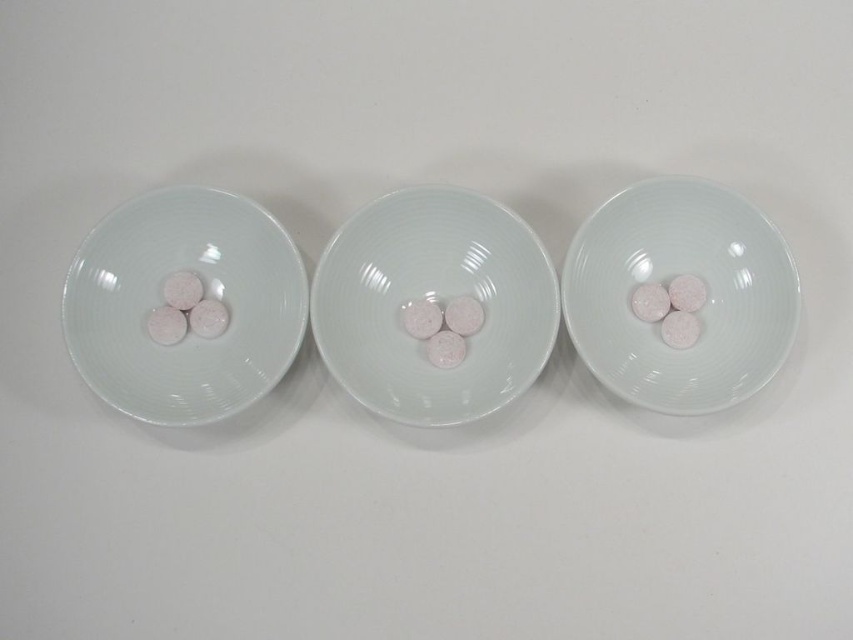
Is porcelain bowls at center smaller than white glossy plate at left?

Yes.

Who is taller, porcelain bowls at center or white glossy plate at left?

porcelain bowls at center

Between point (538, 244) and point (196, 244), which one is positioned in front?

Point (538, 244) is more forward.

This screenshot has height=640, width=853. What are the coordinates of `porcelain bowls at center` in the screenshot? It's located at (436, 300).

Can you confirm if porcelain bowls at center is taller than matte white plate at right?

Yes, porcelain bowls at center is taller than matte white plate at right.

Which is below, porcelain bowls at center or matte white plate at right?

porcelain bowls at center is lower down.

Who is more distant from viewer, [505,388] or [757,289]?

Point [505,388]

I want to click on porcelain bowls at center, so click(x=436, y=300).

Between white glossy plate at left and matte white plate at right, which one is positioned lower?

white glossy plate at left

This screenshot has width=853, height=640. In order to click on white glossy plate at left in this screenshot , I will do `click(201, 288)`.

You are a GUI agent. You are given a task and a screenshot of the screen. Output one action in this format:
    pyautogui.click(x=<x>, y=<y>)
    Task: Click on the white glossy plate at left
    The width and height of the screenshot is (853, 640).
    Given the screenshot: What is the action you would take?
    pyautogui.click(x=201, y=288)